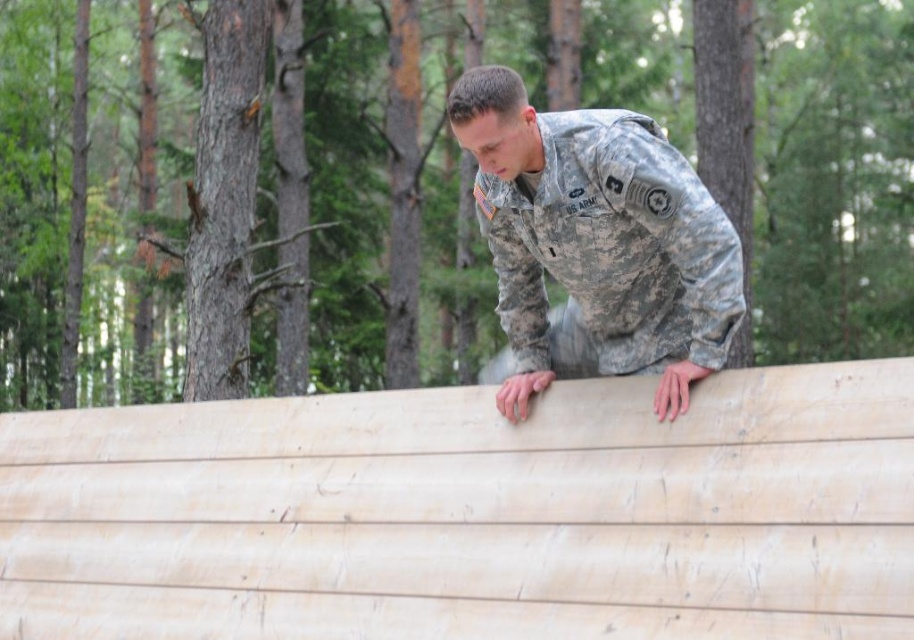
You are a drone operator trying to navigate a drone through a forest area. You have two coordinates to mark for a delivery mission. The first coordinate is point (29, 605) and the second is point (682, 406). Based on the scene, which coordinate is closer to the U.S. Army soldier performing pushups?

Point (682, 406) is closer to the U.S. Army soldier performing pushups because point (29, 605) is behind it according to the spatial description.

You are a drone operator tasked with capturing a closeup of the natural wood plywood at upper center. Given that the drone is currently at the origin point, which is the bottom left corner of the image, can you determine the direction you need to move the drone to reach the plywood?

The natural wood plywood at upper center is located at point (x=471, y=513), which means it is positioned to the right and slightly above the center of the image. Since the drone is at the origin point in the bottom left corner, you should move the drone to the right and upward to reach the plywood.